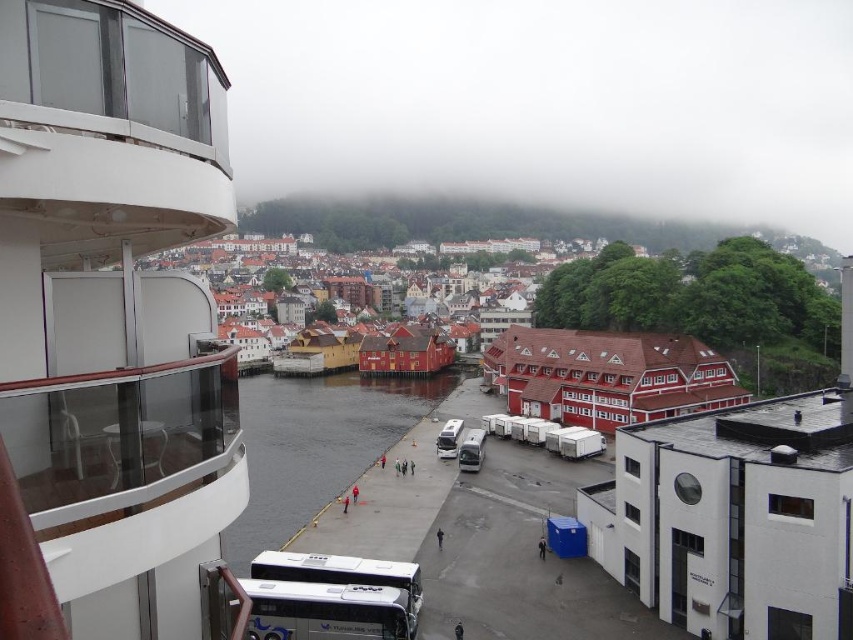
Is point (115, 538) positioned after point (258, 628)?

No.

Where is `white glossy cruise ship at left`? This screenshot has height=640, width=853. white glossy cruise ship at left is located at coordinates coord(114,305).

Is dark gray concrete river at center smaller than reddish-brown wooden houses at center?

Correct, dark gray concrete river at center occupies less space than reddish-brown wooden houses at center.

Between point (239, 541) and point (364, 284), which one is positioned in front?

Point (239, 541) is in front.

You are a GUI agent. You are given a task and a screenshot of the screen. Output one action in this format:
    pyautogui.click(x=<x>, y=<y>)
    Task: Click on the dark gray concrete river at center
    Image resolution: width=853 pixels, height=640 pixels.
    Given the screenshot: What is the action you would take?
    pyautogui.click(x=316, y=444)

Which is more to the right, dark gray concrete river at center or white matte/deck bus at lower center?

white matte/deck bus at lower center is more to the right.

Is dark gray concrete river at center closer to camera compared to white matte/deck bus at lower center?

Yes.

Image resolution: width=853 pixels, height=640 pixels. In order to click on dark gray concrete river at center in this screenshot , I will do `click(316, 444)`.